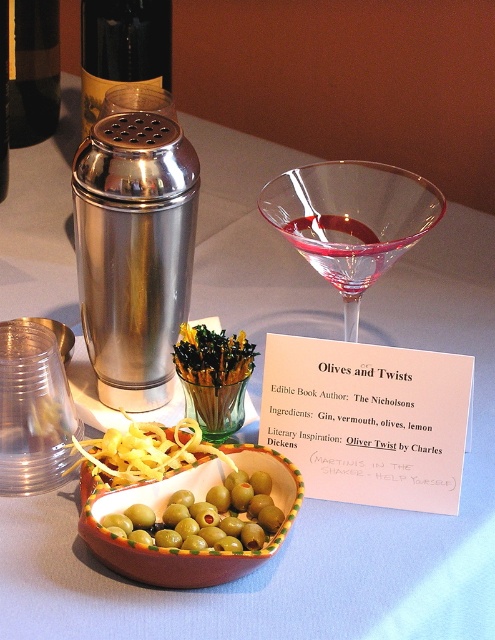
You are a bartender who needs to place a garnish on the martini glass. The greenshinyolive at center and the shiny dark bottle at upper left are both on the table. Which object is closer to the martini glass?

The greenshinyolive at center is closer to the martini glass because it is only 30.27 inches away from the shiny dark bottle at upper left, implying it is nearer than the bottle.